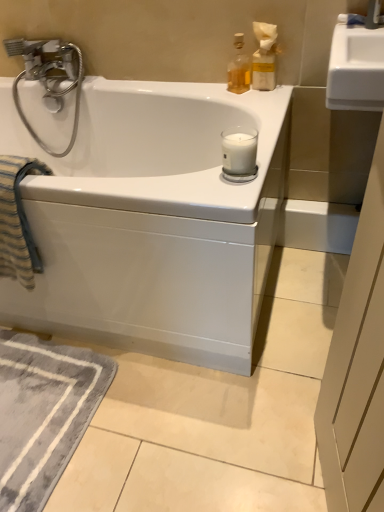
The image size is (384, 512). Find the location of `vacant space situated on the left part of translucent glass bottle at upper right, which is the first bottle from right to left`. vacant space situated on the left part of translucent glass bottle at upper right, which is the first bottle from right to left is located at coordinates (224, 92).